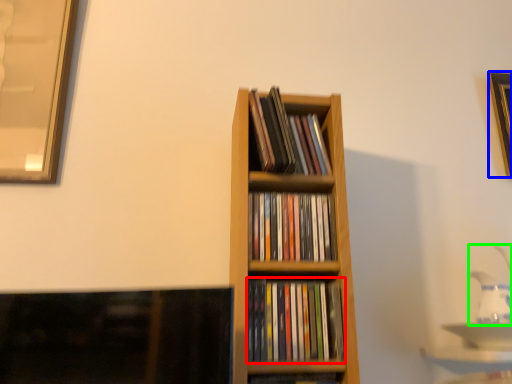
Question: Which object is the closest to the book (highlighted by a red box)? Choose among these: picture frame (highlighted by a blue box) or tea pot (highlighted by a green box).

Choices:
 (A) picture frame
 (B) tea pot

Answer: (B)